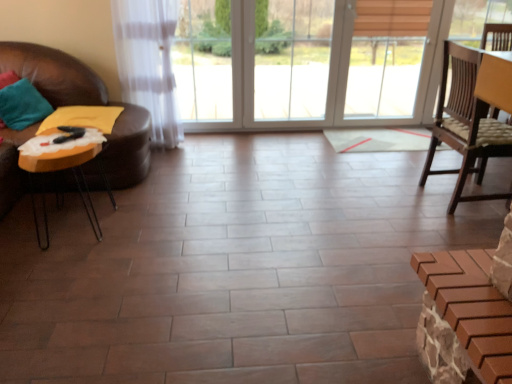
Question: In the image, is teal fabric pillow at left positioned in front of or behind orange glossy table at left?

Choices:
 (A) front
 (B) behind

Answer: (B)

Question: From a real-world perspective, is teal fabric pillow at left positioned above or below orange glossy table at left?

Choices:
 (A) below
 (B) above

Answer: (B)

Question: Is point click(8, 115) closer or farther from the camera than point click(80, 190)?

Choices:
 (A) farther
 (B) closer

Answer: (B)

Question: Considering the positions of orange glossy table at left and teal fabric pillow at left in the image, is orange glossy table at left wider or thinner than teal fabric pillow at left?

Choices:
 (A) thin
 (B) wide

Answer: (B)

Question: From a real-world perspective, is orange glossy table at left above or below teal fabric pillow at left?

Choices:
 (A) below
 (B) above

Answer: (A)

Question: Is orange glossy table at left situated inside teal fabric pillow at left or outside?

Choices:
 (A) outside
 (B) inside

Answer: (A)

Question: Relative to teal fabric pillow at left, is orange glossy table at left in front or behind?

Choices:
 (A) behind
 (B) front

Answer: (B)